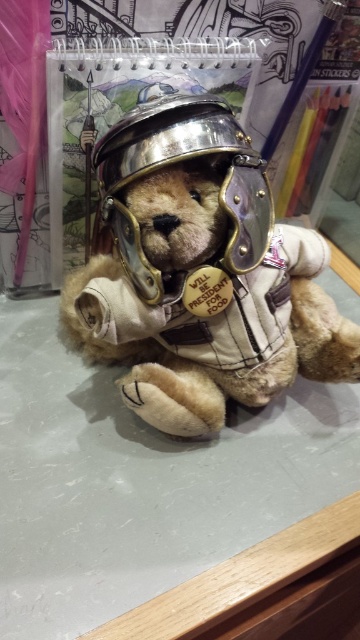
You are a photographer setting up a shot of the velvet brown teddy bear at center and the metallic silver helmet at center. You want to ensure the teddy bear is in focus while the helmet is slightly blurred. Which object should you adjust the camera focus on?

The velvet brown teddy bear at center is located below the metallic silver helmet at center. To focus on the teddy bear while keeping the helmet blurred, adjust the camera focus on the velvet brown teddy bear at center.

Looking at the image of the teddy bear and its helmet, which object is taller between the velvet brown teddy bear at center and the metallic silver helmet at center?

The velvet brown teddy bear at center is taller than the metallic silver helmet at center according to the description.